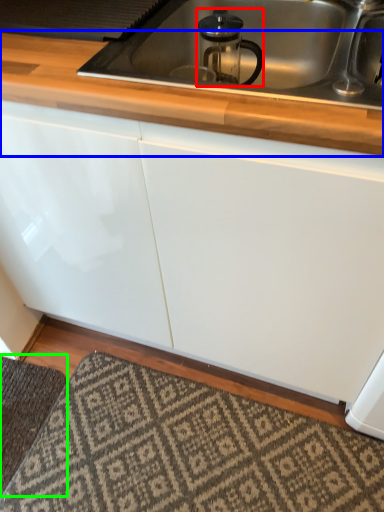
Question: Which is nearer to the appliance (highlighted by a red box)? countertop (highlighted by a blue box) or doormat (highlighted by a green box).

Choices:
 (A) countertop
 (B) doormat

Answer: (A)